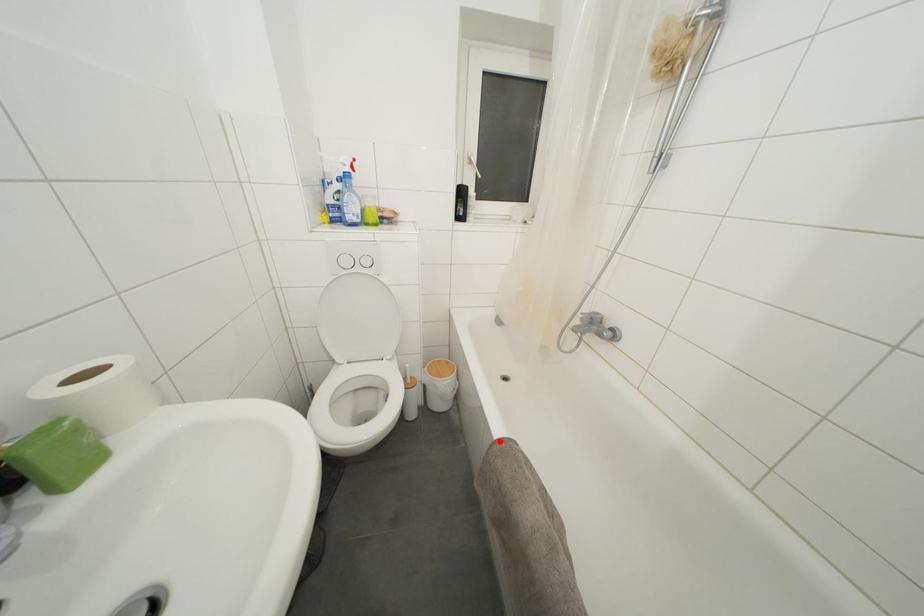
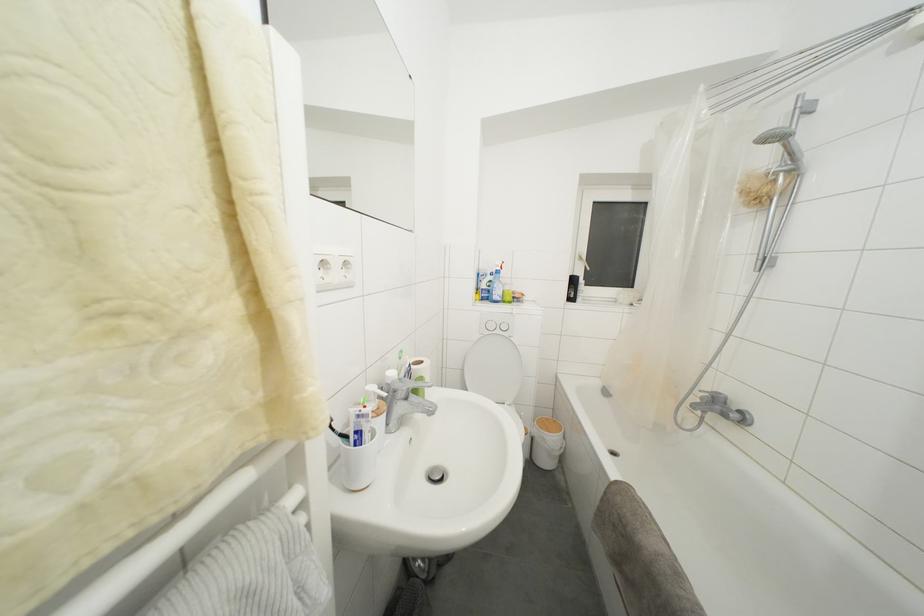
Locate, in the second image, the point that corresponds to the highlighted location in the first image.

(617, 484)